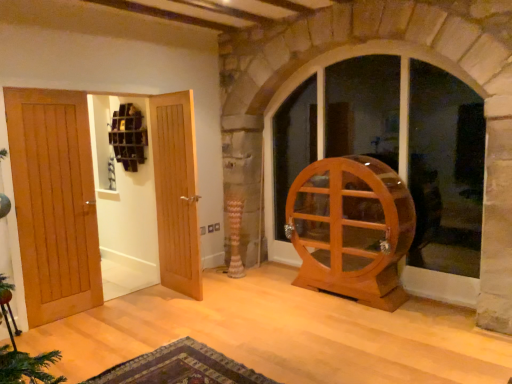
The height and width of the screenshot is (384, 512). I want to click on free space that is to the left of light brown wood door at center, marked as the 1th door in a right-to-left arrangement, so click(144, 300).